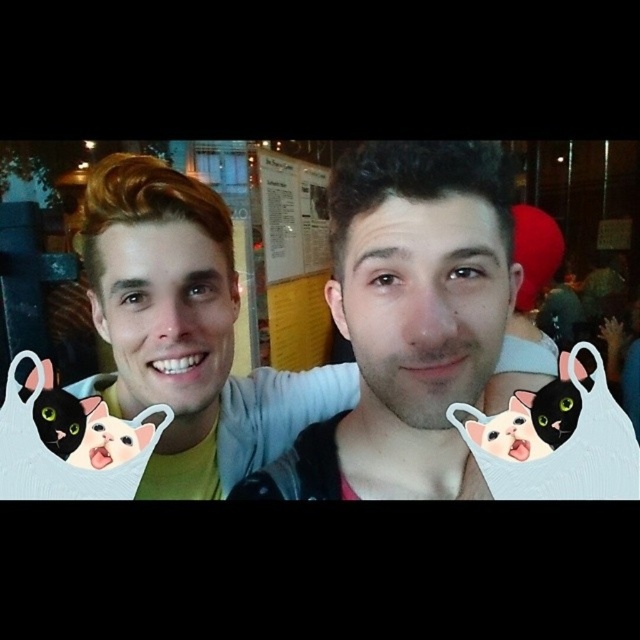
Is matte white shirt at center behind smooth skin face at center?

No, matte white shirt at center is in front of smooth skin face at center.

Can you confirm if matte white shirt at center is positioned to the left of smooth skin face at center?

Correct, you'll find matte white shirt at center to the left of smooth skin face at center.

Does point (502, 298) come behind point (378, 360)?

Yes, it is.

This screenshot has width=640, height=640. In order to click on matte white shirt at center in this screenshot , I will do `click(406, 321)`.

Can you confirm if matte white shirt at center is shorter than black matte cat at left?

No.

Where is `matte white shirt at center`? The height and width of the screenshot is (640, 640). matte white shirt at center is located at coordinates (406, 321).

In order to click on matte white shirt at center in this screenshot , I will do `click(406, 321)`.

Does matte yellow shirt at left appear under black matte cat at left?

Actually, matte yellow shirt at left is above black matte cat at left.

Does matte yellow shirt at left come behind black matte cat at left?

Yes, it is.

I want to click on matte yellow shirt at left, so click(164, 314).